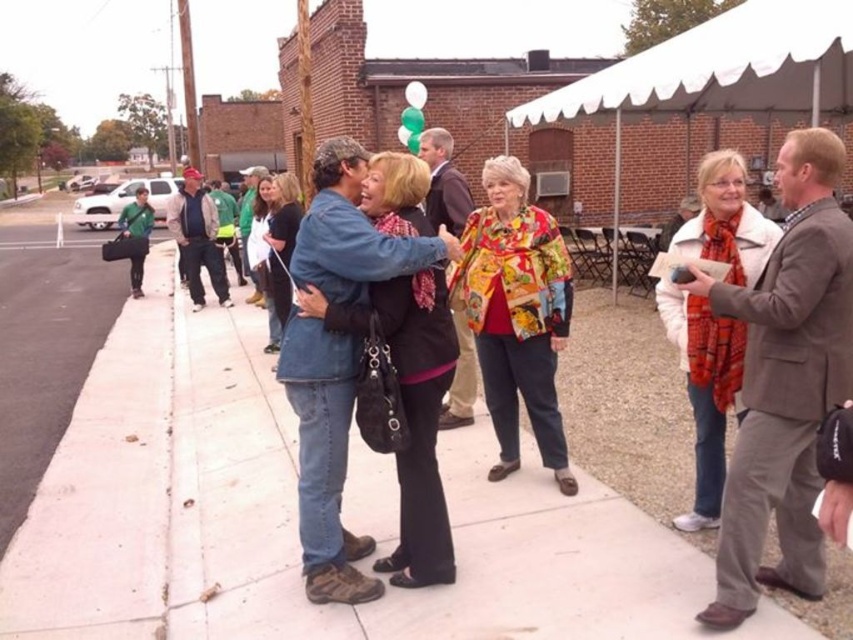
Question: Is white concrete sidewalk at center thinner than denim jacket at center?

Choices:
 (A) no
 (B) yes

Answer: (A)

Question: Considering the relative positions of white concrete sidewalk at center and denim jacket at center in the image provided, where is white concrete sidewalk at center located with respect to denim jacket at center?

Choices:
 (A) above
 (B) below

Answer: (B)

Question: Considering the relative positions of white canvas canopy at upper center and green fabric bag at left in the image provided, where is white canvas canopy at upper center located with respect to green fabric bag at left?

Choices:
 (A) above
 (B) below

Answer: (A)

Question: Which point is closer to the camera taking this photo?

Choices:
 (A) (635, 58)
 (B) (198, 260)

Answer: (A)

Question: Estimate the real-world distances between objects in this image. Which object is farther from the white fabric canopy at upper right?

Choices:
 (A) white concrete sidewalk at center
 (B) denim jacket at center

Answer: (B)

Question: Which point is farther from the camera taking this photo?

Choices:
 (A) (316, 557)
 (B) (392, 508)

Answer: (B)